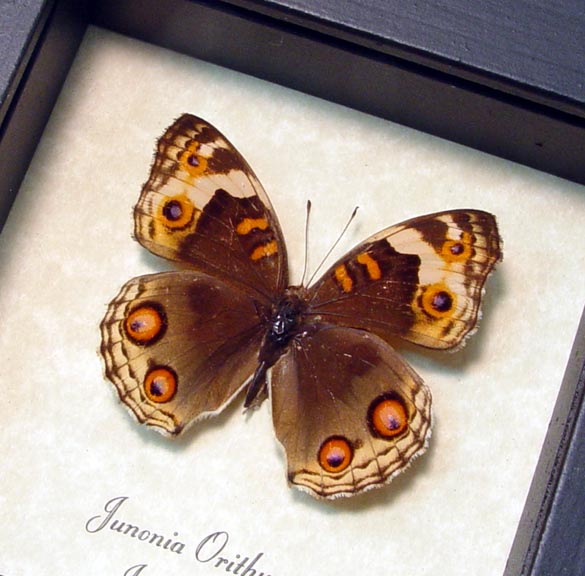
Find the location of a particular element. surface is located at coordinates (546, 79), (574, 514), (10, 62).